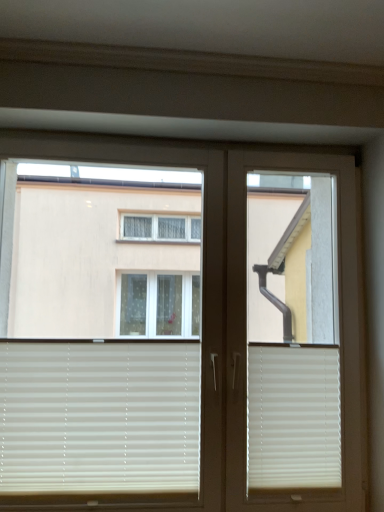
Question: From their relative heights in the image, would you say white plastic screen door at center is taller or shorter than beige matte blinds at lower left, which is counted as the 2th window blind, starting from the right?

Choices:
 (A) short
 (B) tall

Answer: (B)

Question: Would you say white plastic screen door at center is inside or outside beige matte blinds at lower left, the first window blind in the left-to-right sequence?

Choices:
 (A) inside
 (B) outside

Answer: (B)

Question: Which of these objects is positioned closest to the white matte window blind at lower right, acting as the second window blind starting from the left?

Choices:
 (A) beige matte blinds at lower left, the first window blind in the left-to-right sequence
 (B) white plastic screen door at center
 (C) white matte window at upper left

Answer: (B)

Question: Which is nearer to the white matte window at upper left?

Choices:
 (A) beige matte blinds at lower left, which is counted as the 2th window blind, starting from the right
 (B) white matte window blind at lower right, acting as the second window blind starting from the left
 (C) white plastic screen door at center

Answer: (C)